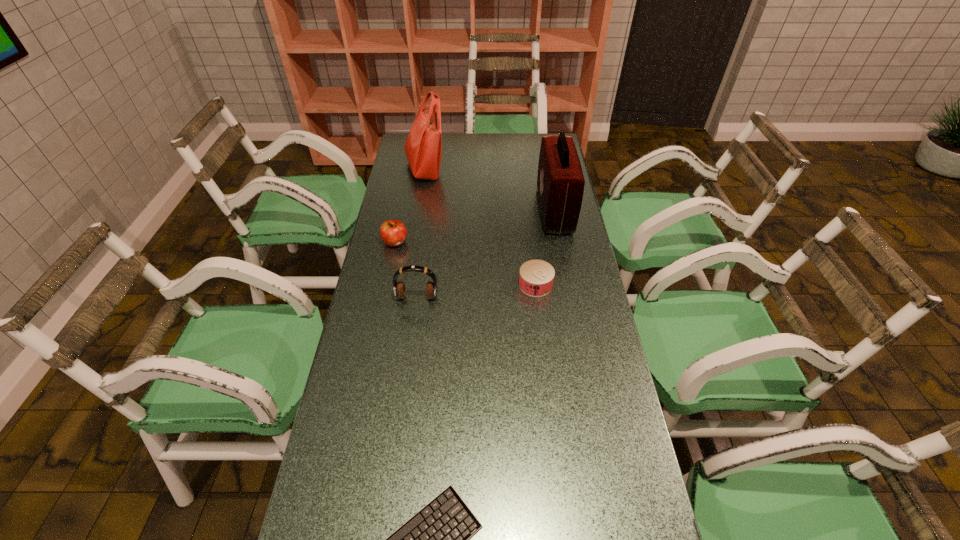
Locate an element on the screen. Image resolution: width=960 pixels, height=540 pixels. free space at the right edge of the desktop is located at coordinates (567, 336).

At what (x,y) coordinates should I click in order to perform the action: click on vacant space at the far right corner. Please return your answer as a coordinate pair (x, y). Image resolution: width=960 pixels, height=540 pixels. Looking at the image, I should click on (525, 147).

This screenshot has width=960, height=540. Identify the location of free space that is in between the can and the farthest object. (480, 226).

Identify the location of unoccupied area between the first aid kit and the apple. The width and height of the screenshot is (960, 540). (475, 226).

Identify the location of free area in between the first aid kit and the third tallest object. (486, 254).

Identify the location of blank region between the apple and the handbag. (410, 205).

You are a GUI agent. You are given a task and a screenshot of the screen. Output one action in this format:
    pyautogui.click(x=<x>, y=<y>)
    Task: Click on the empty location between the second shortest object and the apple
    Image resolution: width=960 pixels, height=540 pixels.
    Given the screenshot: What is the action you would take?
    pyautogui.click(x=466, y=264)

Find the location of a particular element. The image size is (960, 540). vacant space that's between the first aid kit and the farthest object is located at coordinates (490, 189).

At what (x,y) coordinates should I click in order to perform the action: click on object that is the fifth closest to the can. Please return your answer as a coordinate pair (x, y). Image resolution: width=960 pixels, height=540 pixels. Looking at the image, I should click on (423, 147).

The image size is (960, 540). What are the coordinates of `object that is the second closest to the handbag` in the screenshot? It's located at (560, 182).